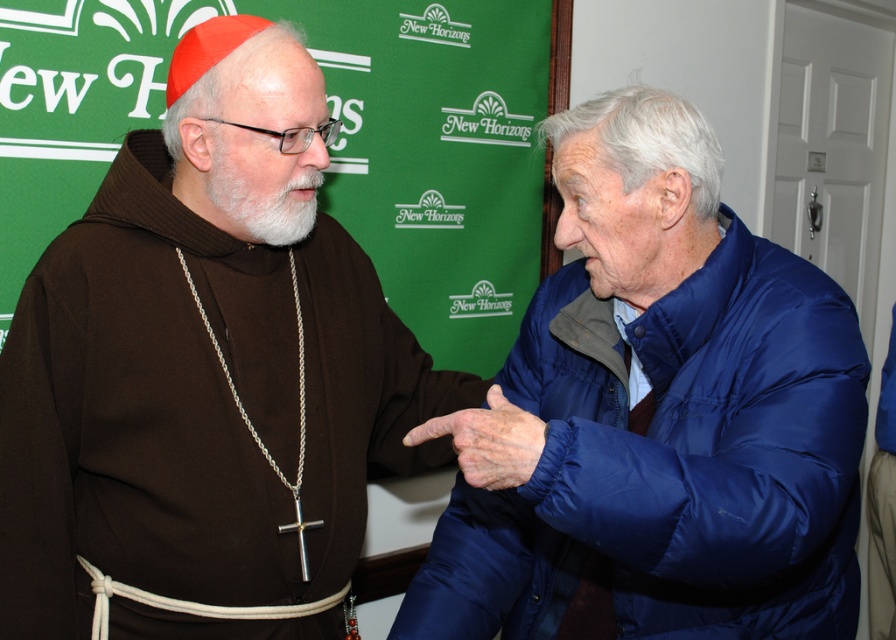
Image resolution: width=896 pixels, height=640 pixels. Describe the element at coordinates (655, 417) in the screenshot. I see `blue puffy jacket at right` at that location.

Can you confirm if blue puffy jacket at right is taller than dry skin at center?

Yes.

Between point (610, 134) and point (488, 483), which one is positioned behind?

Point (610, 134)

The width and height of the screenshot is (896, 640). In order to click on blue puffy jacket at right in this screenshot , I will do `click(655, 417)`.

Does brown woolen robe at left appear over dry skin at center?

Indeed, brown woolen robe at left is positioned over dry skin at center.

Is point (147, 348) in front of point (526, 433)?

No, (147, 348) is further to viewer.

Find the location of a particular element. brown woolen robe at left is located at coordinates (205, 372).

Is brown woolen robe at left bigger than blue puffy jacket at right?

Yes, brown woolen robe at left is bigger than blue puffy jacket at right.

Is point (446, 451) less distant than point (843, 424)?

No.

The width and height of the screenshot is (896, 640). Describe the element at coordinates (205, 372) in the screenshot. I see `brown woolen robe at left` at that location.

Locate an element on the screen. brown woolen robe at left is located at coordinates (x=205, y=372).